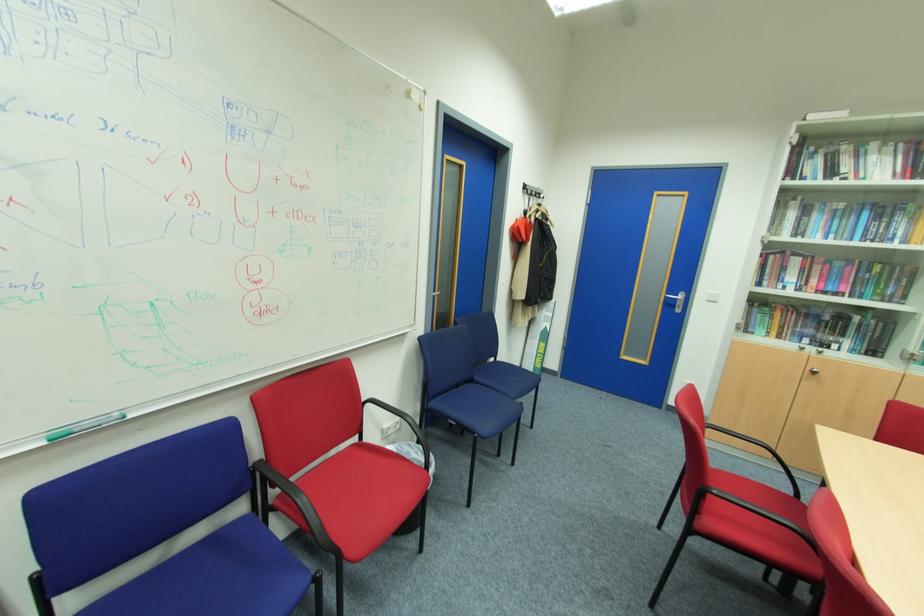
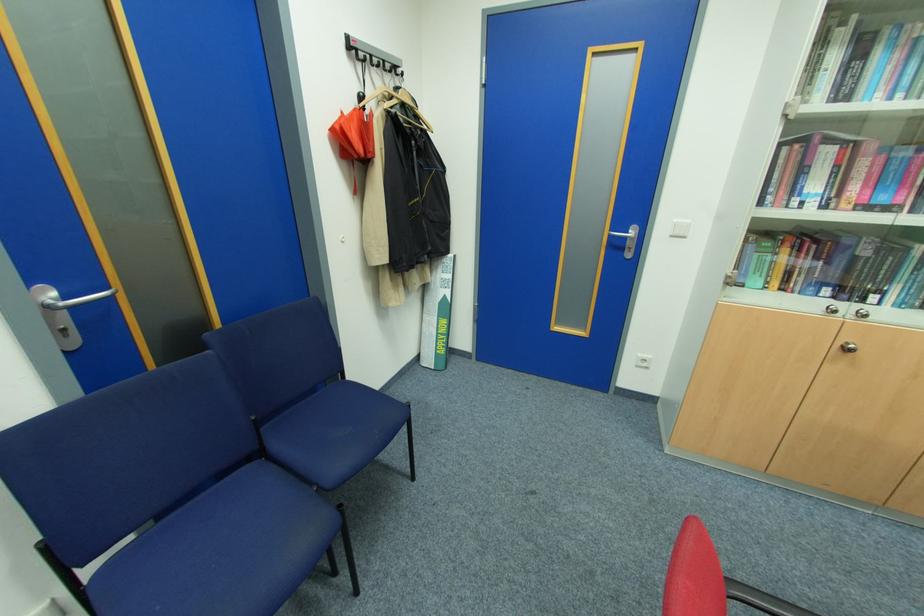
The point at [820,371] is marked in the first image. Where is the corresponding point in the second image?

(856, 346)